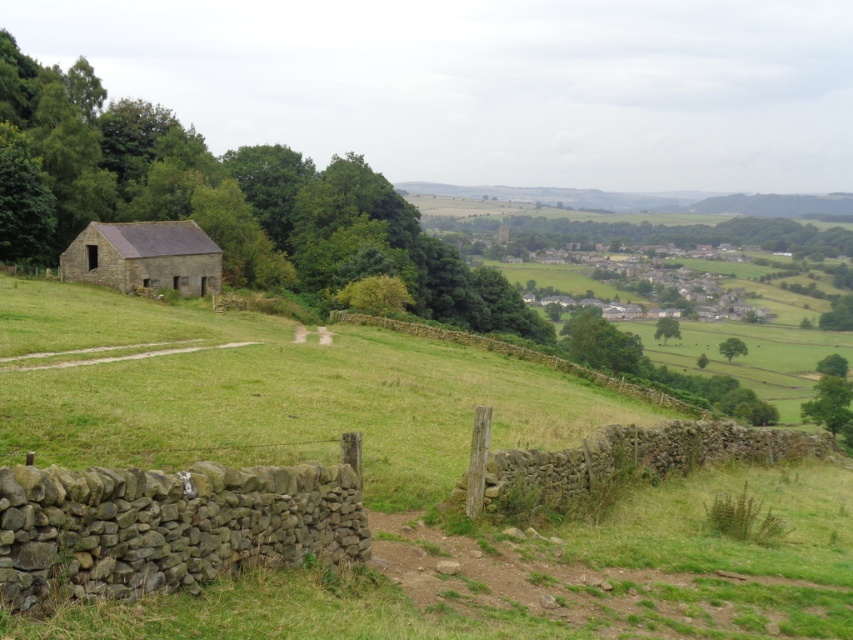
Where is `brown stone wall at lower center`? brown stone wall at lower center is located at coordinates (625, 460).

The image size is (853, 640). Describe the element at coordinates (625, 460) in the screenshot. I see `brown stone wall at lower center` at that location.

Describe the element at coordinates (625, 460) in the screenshot. I see `brown stone wall at lower center` at that location.

The image size is (853, 640). I want to click on brown stone wall at lower center, so coord(625,460).

Between brown stone wall at lower center and rustic stone barn at lower left, which one appears on the left side from the viewer's perspective?

rustic stone barn at lower left is more to the left.

Measure the distance between brown stone wall at lower center and camera.

They are 11.12 meters apart.

Is point (781, 456) farther from viewer compared to point (68, 268)?

No, (781, 456) is closer to viewer.

The width and height of the screenshot is (853, 640). In order to click on brown stone wall at lower center in this screenshot , I will do `click(625, 460)`.

The width and height of the screenshot is (853, 640). What do you see at coordinates (171, 524) in the screenshot? I see `brown stone wall at lower left` at bounding box center [171, 524].

Looking at this image, who is taller, brown stone wall at lower left or rustic stone barn at lower left?

Standing taller between the two is rustic stone barn at lower left.

Between point (0, 492) and point (106, 236), which one is positioned in front?

Point (0, 492)

Locate an element on the screen. Image resolution: width=853 pixels, height=640 pixels. brown stone wall at lower left is located at coordinates (171, 524).